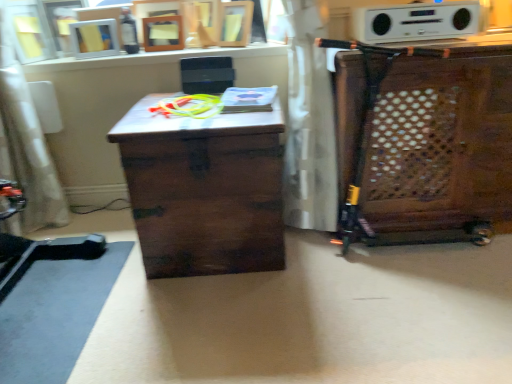
Question: Is the depth of white matte picture frame at upper left less than that of wooden cabinet at right?

Choices:
 (A) no
 (B) yes

Answer: (A)

Question: Considering the relative positions of white matte picture frame at upper left and wooden cabinet at right in the image provided, is white matte picture frame at upper left behind wooden cabinet at right?

Choices:
 (A) yes
 (B) no

Answer: (A)

Question: From the image's perspective, is white matte picture frame at upper left located above wooden cabinet at right?

Choices:
 (A) yes
 (B) no

Answer: (A)

Question: Is white matte picture frame at upper left not inside wooden cabinet at right?

Choices:
 (A) no
 (B) yes

Answer: (B)

Question: Considering the relative positions of white matte picture frame at upper left and wooden cabinet at right in the image provided, is white matte picture frame at upper left to the left of wooden cabinet at right from the viewer's perspective?

Choices:
 (A) no
 (B) yes

Answer: (B)

Question: Could you tell me if white matte picture frame at upper left is turned towards wooden cabinet at right?

Choices:
 (A) yes
 (B) no

Answer: (B)

Question: Does white fabric swivel chair at left have a greater height compared to dark wood trunk at center?

Choices:
 (A) yes
 (B) no

Answer: (A)

Question: From the image's perspective, is white fabric swivel chair at left on dark wood trunk at center?

Choices:
 (A) yes
 (B) no

Answer: (A)

Question: Is dark wood trunk at center a part of white fabric swivel chair at left?

Choices:
 (A) yes
 (B) no

Answer: (B)

Question: Does white fabric swivel chair at left have a lesser height compared to dark wood trunk at center?

Choices:
 (A) yes
 (B) no

Answer: (B)

Question: Can you confirm if white fabric swivel chair at left is thinner than dark wood trunk at center?

Choices:
 (A) yes
 (B) no

Answer: (A)

Question: Is white fabric swivel chair at left oriented towards dark wood trunk at center?

Choices:
 (A) yes
 (B) no

Answer: (B)

Question: From a real-world perspective, is wooden cabinet at right physically above white plastic stereo at upper center?

Choices:
 (A) yes
 (B) no

Answer: (B)